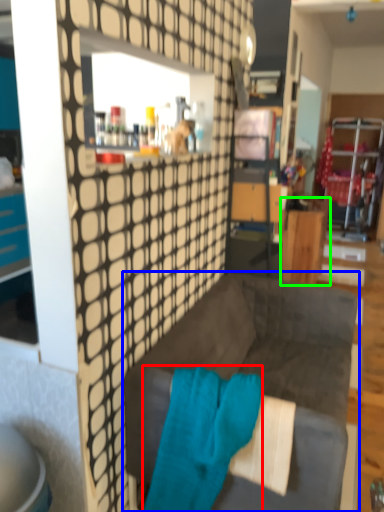
Question: Based on their relative distances, which object is nearer to bath towel (highlighted by a red box)? Choose from studio couch (highlighted by a blue box) and desk (highlighted by a green box).

Choices:
 (A) studio couch
 (B) desk

Answer: (A)